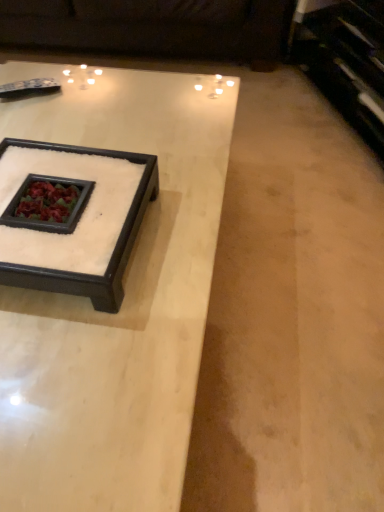
Question: From the image's perspective, does white marble tray at center, the first coffee table when ordered from back to front, appear lower than dark brown leather couch at upper center?

Choices:
 (A) yes
 (B) no

Answer: (A)

Question: Considering the relative sizes of white marble tray at center, acting as the second coffee table starting from the front, and dark brown leather couch at upper center in the image provided, is white marble tray at center, acting as the second coffee table starting from the front, smaller than dark brown leather couch at upper center?

Choices:
 (A) yes
 (B) no

Answer: (A)

Question: Considering the relative positions of white marble tray at center, acting as the second coffee table starting from the front, and dark brown leather couch at upper center in the image provided, is white marble tray at center, acting as the second coffee table starting from the front, to the left of dark brown leather couch at upper center from the viewer's perspective?

Choices:
 (A) no
 (B) yes

Answer: (A)

Question: Does white marble tray at center, acting as the second coffee table starting from the front, have a greater height compared to dark brown leather couch at upper center?

Choices:
 (A) no
 (B) yes

Answer: (A)

Question: Would you say white marble tray at center, the first coffee table when ordered from back to front, contains dark brown leather couch at upper center?

Choices:
 (A) yes
 (B) no

Answer: (B)

Question: Considering the relative positions of white marble coffee table at center, the second coffee table from the back, and white marble tray at center, acting as the second coffee table starting from the front, in the image provided, is white marble coffee table at center, the second coffee table from the back, to the right of white marble tray at center, acting as the second coffee table starting from the front, from the viewer's perspective?

Choices:
 (A) yes
 (B) no

Answer: (B)

Question: Does white marble coffee table at center, the second coffee table from the back, turn towards white marble tray at center, acting as the second coffee table starting from the front?

Choices:
 (A) no
 (B) yes

Answer: (A)

Question: From a real-world perspective, is white marble coffee table at center, the second coffee table from the back, beneath white marble tray at center, acting as the second coffee table starting from the front?

Choices:
 (A) no
 (B) yes

Answer: (B)

Question: Is white marble coffee table at center, the second coffee table from the back, wider than white marble tray at center, the first coffee table when ordered from back to front?

Choices:
 (A) no
 (B) yes

Answer: (B)

Question: From the image's perspective, would you say white marble coffee table at center, the second coffee table from the back, is shown under white marble tray at center, acting as the second coffee table starting from the front?

Choices:
 (A) yes
 (B) no

Answer: (A)

Question: Is white marble coffee table at center, the second coffee table from the back, completely or partially outside of white marble tray at center, acting as the second coffee table starting from the front?

Choices:
 (A) no
 (B) yes

Answer: (B)

Question: From a real-world perspective, is white marble tray at center, the first coffee table when ordered from back to front, under white marble coffee table at center, which ranks as the first coffee table in front-to-back order?

Choices:
 (A) no
 (B) yes

Answer: (A)